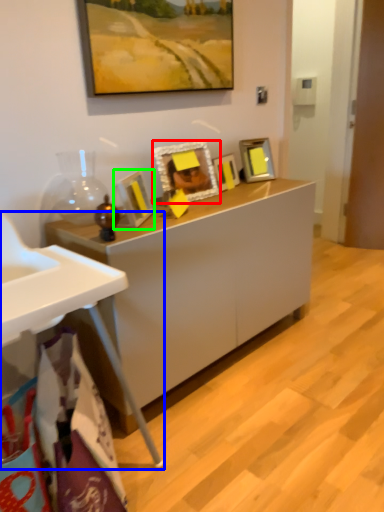
Question: Which object is the closest to the picture frame (highlighted by a red box)? Choose among these: table (highlighted by a blue box) or picture frame (highlighted by a green box).

Choices:
 (A) table
 (B) picture frame

Answer: (B)